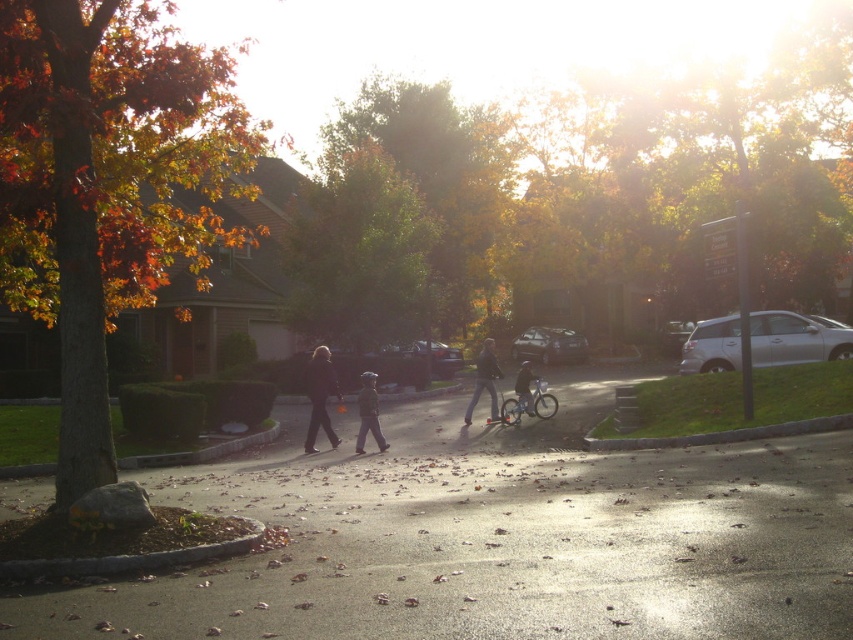
Does matte black jacket at center have a larger size compared to matte black bicycle at center?

No.

Locate an element on the screen. matte black jacket at center is located at coordinates (368, 413).

The height and width of the screenshot is (640, 853). I want to click on matte black jacket at center, so (368, 413).

Can you confirm if autumn leaves at left is thinner than matte black jacket at center?

In fact, autumn leaves at left might be wider than matte black jacket at center.

Which of these two, autumn leaves at left or matte black jacket at center, stands shorter?

matte black jacket at center

Where is `autumn leaves at left`? The width and height of the screenshot is (853, 640). autumn leaves at left is located at coordinates (107, 184).

Which of these two, autumn leaves at left or green leafy tree at center, stands shorter?

With less height is green leafy tree at center.

Is autumn leaves at left below green leafy tree at center?

No.

Who is more forward, (x=68, y=33) or (x=410, y=291)?

Point (x=68, y=33) is more forward.

Where is `autumn leaves at left`? autumn leaves at left is located at coordinates (107, 184).